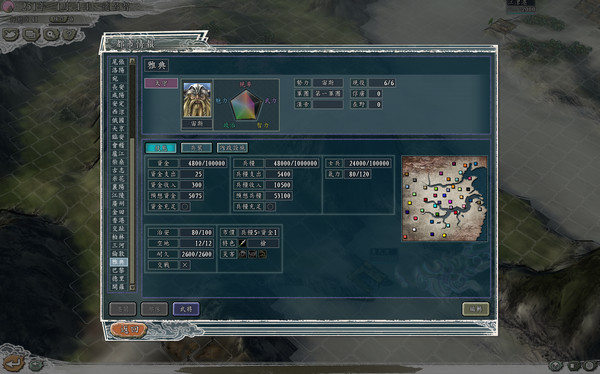
You are a GUI agent. You are given a task and a screenshot of the screen. Output one action in this format:
    pyautogui.click(x=<x>, y=<y>)
    Task: Click on the portrait
    The image size is (600, 374).
    Given the screenshot: What is the action you would take?
    pyautogui.click(x=196, y=100)